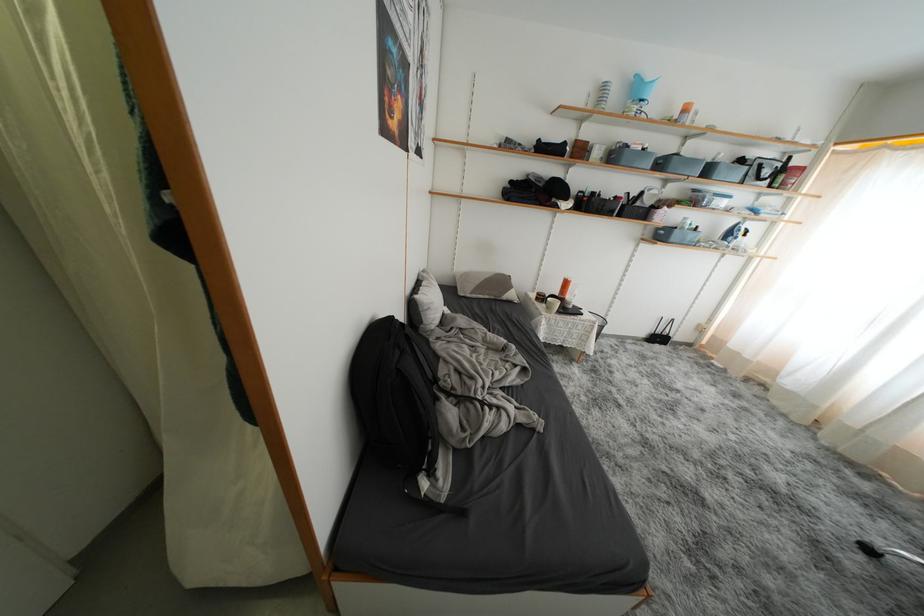
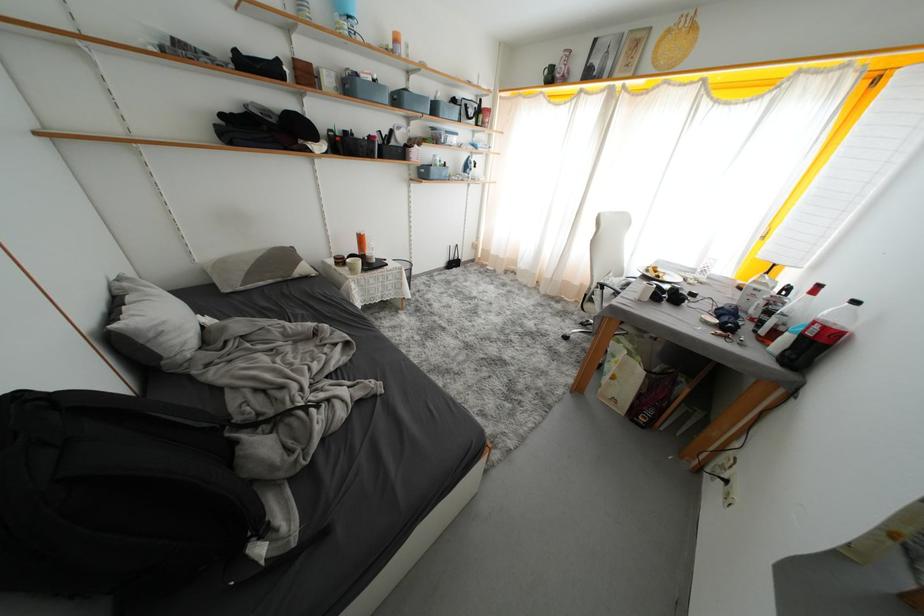
Where in the second image is the point corresponding to point (648, 197) from the first image?

(397, 136)